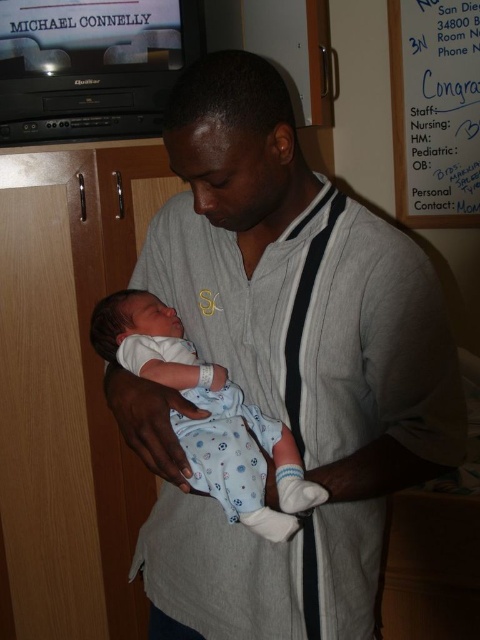
Question: Based on their relative distances, which object is nearer to the blue cotton onesie at center?

Choices:
 (A) white paper at upper right
 (B) gray cotton shirt at center

Answer: (B)

Question: Can you confirm if blue cotton onesie at center is bigger than white paper at upper right?

Choices:
 (A) no
 (B) yes

Answer: (A)

Question: Which object is the closest to the blue cotton onesie at center?

Choices:
 (A) gray cotton shirt at center
 (B) white paper at upper right

Answer: (A)

Question: In this image, where is gray cotton shirt at center located relative to white paper at upper right?

Choices:
 (A) below
 (B) above

Answer: (A)

Question: Among these points, which one is farthest from the camera?

Choices:
 (A) (126, 296)
 (B) (369, 280)

Answer: (A)

Question: Is gray cotton shirt at center smaller than blue cotton onesie at center?

Choices:
 (A) yes
 (B) no

Answer: (B)